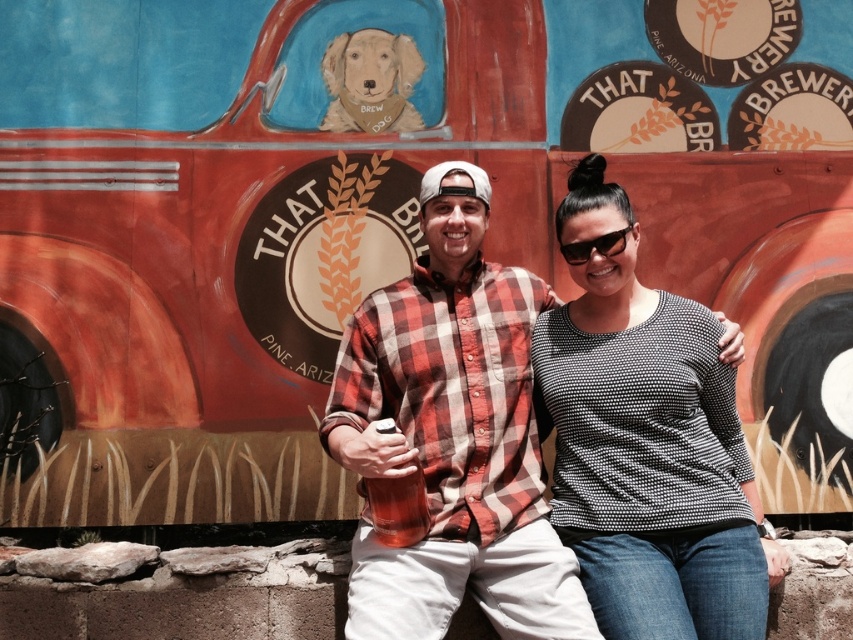
You are a photographer trying to capture a group photo of the plaid cotton shirt at center and the black dotted sweater at center. If you want to ensure both subjects are fully visible in the frame, which subject should you position closer to the camera to avoid cropping?

The plaid cotton shirt at center might be wider than the black dotted sweater at center, so positioning the plaid cotton shirt at center closer to the camera would help ensure both are fully visible without cropping.

Looking at this image, you are a photographer trying to capture a clear shot of the golden fur dog at upper center and the black plastic sunglasses at center. Which object should you focus on first to ensure both are in focus?

You should focus on the golden fur dog at upper center first because it is closer to you than the black plastic sunglasses at center, so focusing on the closer object will help both be in focus.

You are standing at the camera position and want to throw a ball to a friend who is at point (706, 580). Is the distance within your throwing range of 8 meters?

The distance of point (706, 580) from camera is 7.43 meters, so yes, it is within your throwing range of 8 meters.